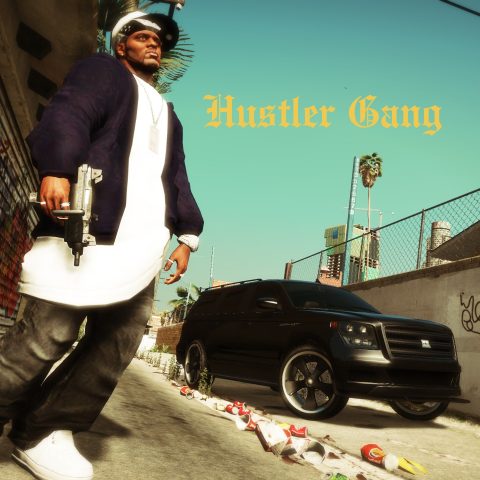
Where is `wall`? This screenshot has height=480, width=480. wall is located at coordinates (408, 297).